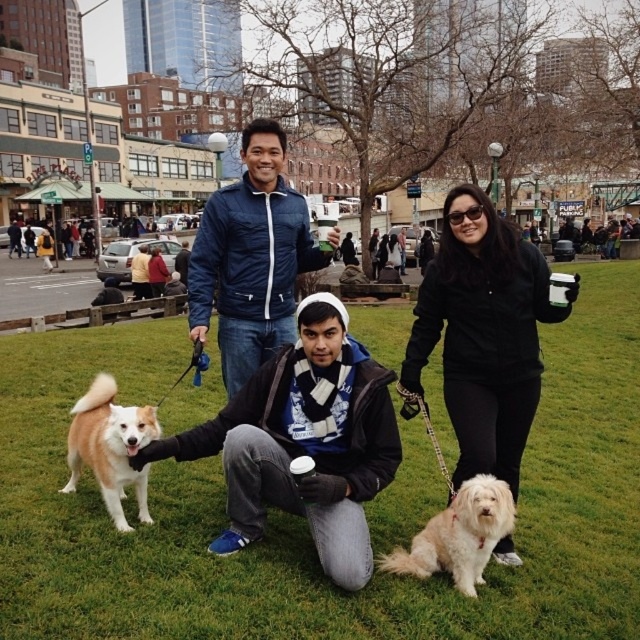
You are standing at the point marked by the coordinates point (305, 522) in the image. What is the color of the ground beneath your feet?

The point (305, 522) marks green grass at center, so the ground beneath your feet is green grass.

You are standing at the point labeled as point (x=305, y=522) in the image. What is the terrain like at your current location?

The terrain at point (x=305, y=522) is green grass at center.